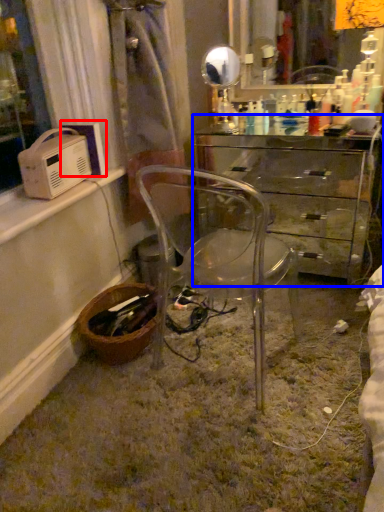
Question: Which of the following is the farthest to the observer, appliance (highlighted by a red box) or desk (highlighted by a blue box)?

Choices:
 (A) appliance
 (B) desk

Answer: (B)